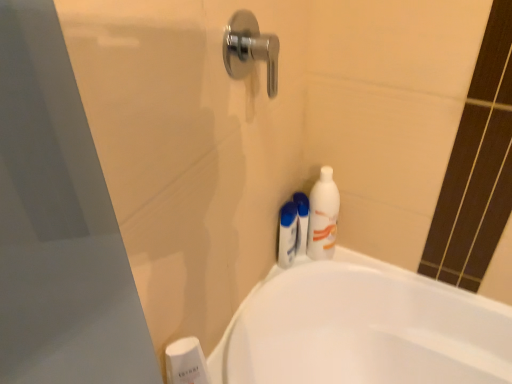
Question: Considering the relative positions of white glossy bathtub at lower right and white plastic soap dispenser at lower left, which ranks as the 1th toiletry in bottom-to-top order, in the image provided, is white glossy bathtub at lower right to the right of white plastic soap dispenser at lower left, which ranks as the 1th toiletry in bottom-to-top order, from the viewer's perspective?

Choices:
 (A) yes
 (B) no

Answer: (A)

Question: Can you confirm if white glossy bathtub at lower right is taller than white plastic soap dispenser at lower left, which ranks as the 1th toiletry in bottom-to-top order?

Choices:
 (A) no
 (B) yes

Answer: (B)

Question: From a real-world perspective, is white glossy bathtub at lower right over white plastic soap dispenser at lower left, the second toiletry in the right-to-left sequence?

Choices:
 (A) no
 (B) yes

Answer: (A)

Question: Does white glossy bathtub at lower right appear on the left side of white plastic soap dispenser at lower left, arranged as the second toiletry when viewed from the top?

Choices:
 (A) no
 (B) yes

Answer: (A)

Question: Is white glossy bathtub at lower right with white plastic soap dispenser at lower left, the second toiletry in the right-to-left sequence?

Choices:
 (A) no
 (B) yes

Answer: (A)

Question: Looking at the image, does white plastic soap dispenser at lower left, the second toiletry in the right-to-left sequence, seem bigger or smaller compared to white matte shaving cream at upper right?

Choices:
 (A) big
 (B) small

Answer: (A)

Question: From a real-world perspective, is white plastic soap dispenser at lower left, arranged as the 1th toiletry when viewed from the front, positioned above or below white matte shaving cream at upper right?

Choices:
 (A) below
 (B) above

Answer: (A)

Question: Considering the positions of white plastic soap dispenser at lower left, which ranks as the 1th toiletry in bottom-to-top order, and white matte shaving cream at upper right in the image, is white plastic soap dispenser at lower left, which ranks as the 1th toiletry in bottom-to-top order, wider or thinner than white matte shaving cream at upper right?

Choices:
 (A) wide
 (B) thin

Answer: (B)

Question: Considering their positions, is white plastic soap dispenser at lower left, arranged as the 1th toiletry when viewed from the front, located in front of or behind white matte shaving cream at upper right?

Choices:
 (A) behind
 (B) front

Answer: (B)

Question: From the image's perspective, is white matte bottle at right above or below white matte shaving cream at upper right?

Choices:
 (A) below
 (B) above

Answer: (B)

Question: Choose the correct answer: Is white matte bottle at right inside white matte shaving cream at upper right or outside it?

Choices:
 (A) outside
 (B) inside

Answer: (A)

Question: Is point (324, 226) closer or farther from the camera than point (298, 215)?

Choices:
 (A) farther
 (B) closer

Answer: (A)

Question: Looking at their shapes, would you say white matte bottle at right is wider or thinner than white matte shaving cream at upper right?

Choices:
 (A) thin
 (B) wide

Answer: (B)

Question: From a real-world perspective, is white matte shaving cream at upper right physically located above or below white matte bottle at right?

Choices:
 (A) above
 (B) below

Answer: (B)

Question: Considering the positions of white matte shaving cream at upper right and white matte bottle at right in the image, is white matte shaving cream at upper right taller or shorter than white matte bottle at right?

Choices:
 (A) short
 (B) tall

Answer: (A)